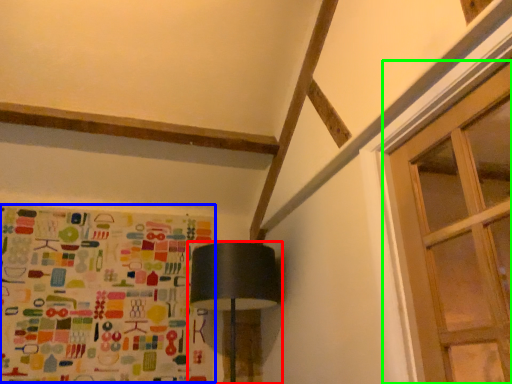
Question: Considering the real-world distances, which object is farthest from lamp (highlighted by a red box)? print (highlighted by a blue box) or window (highlighted by a green box)?

Choices:
 (A) print
 (B) window

Answer: (B)